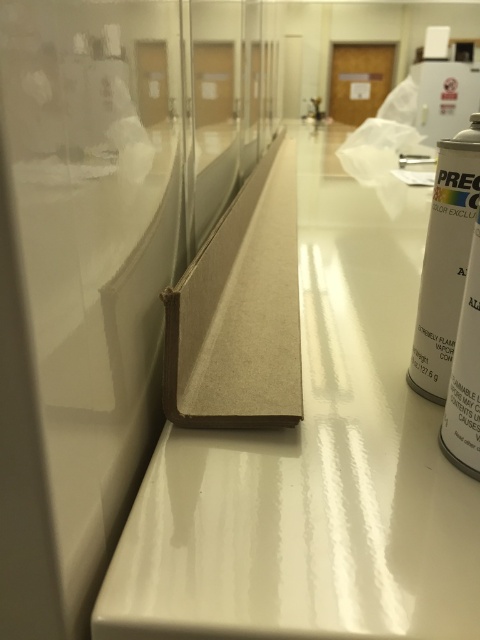
Can you confirm if white matte spray can at right is smaller than matte silver spray can at right?

No, white matte spray can at right is not smaller than matte silver spray can at right.

Is white matte spray can at right below matte silver spray can at right?

Incorrect, white matte spray can at right is not positioned below matte silver spray can at right.

This screenshot has height=640, width=480. Describe the element at coordinates (444, 260) in the screenshot. I see `white matte spray can at right` at that location.

Locate an element on the screen. white matte spray can at right is located at coordinates (444, 260).

Does brown cardboard at center lie behind white matte spray can at right?

No, brown cardboard at center is closer to the viewer.

Measure the distance between brown cardboard at center and white matte spray can at right.

brown cardboard at center is 13.02 inches from white matte spray can at right.

The width and height of the screenshot is (480, 640). Describe the element at coordinates (314, 461) in the screenshot. I see `brown cardboard at center` at that location.

Where is `brown cardboard at center`? The width and height of the screenshot is (480, 640). brown cardboard at center is located at coordinates (314, 461).

Does brown cardboard at center have a larger size compared to matte silver spray can at right?

Indeed, brown cardboard at center has a larger size compared to matte silver spray can at right.

From the picture: Is brown cardboard at center to the left of matte silver spray can at right from the viewer's perspective?

Incorrect, brown cardboard at center is not on the left side of matte silver spray can at right.

Who is more distant from viewer, (360, 413) or (474, 470)?

The point (360, 413) is behind.

The width and height of the screenshot is (480, 640). In order to click on brown cardboard at center in this screenshot , I will do `click(314, 461)`.